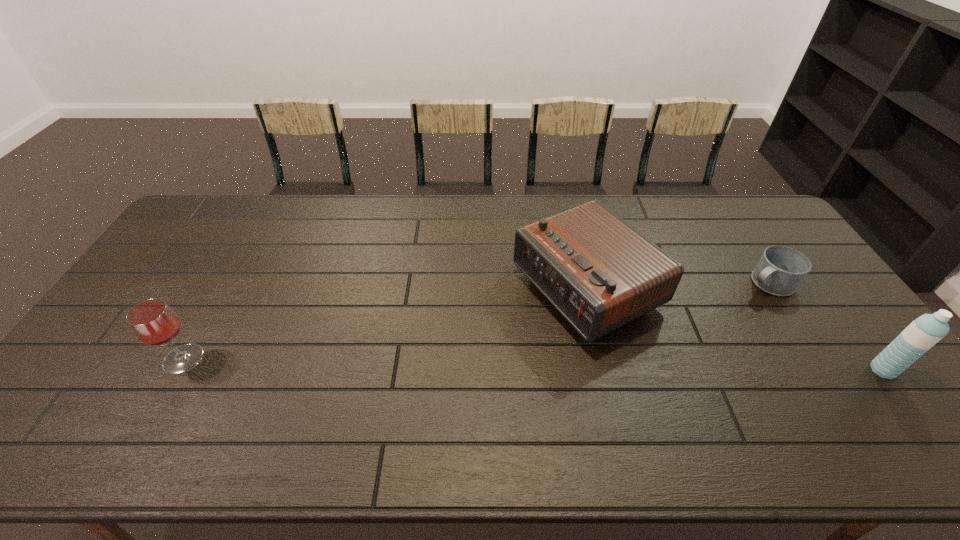
This screenshot has height=540, width=960. In order to click on vacant position in the image that satisfies the following two spatial constraints: 1. on the front side of the second object from right to left; 2. on the left side of the water bottle in this screenshot , I will do `click(824, 370)`.